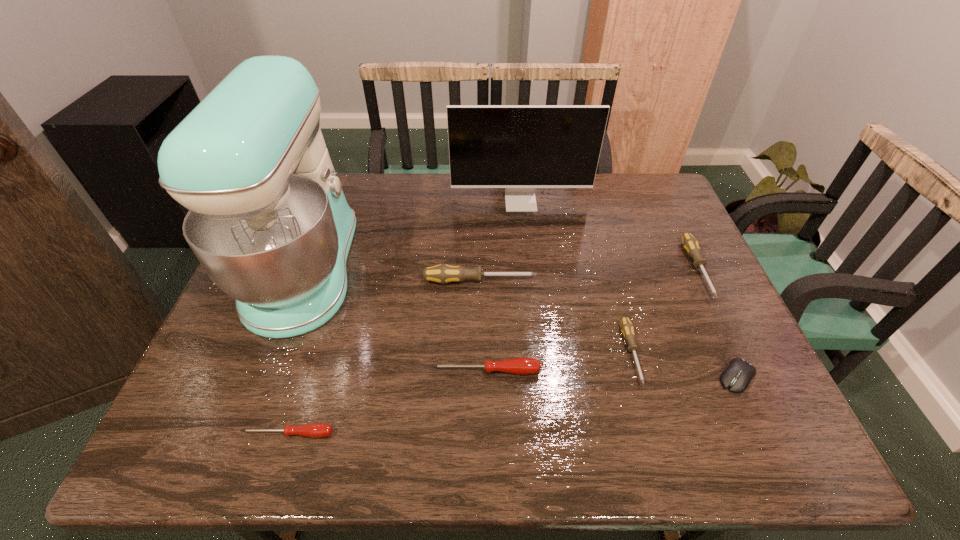
You are a GUI agent. You are given a task and a screenshot of the screen. Output one action in this format:
    pyautogui.click(x=<x>, y=<y>)
    Task: Click on the tallest object
    
    Given the screenshot: What is the action you would take?
    pyautogui.click(x=268, y=220)

Identify the location of mixer. (268, 220).

At what (x,y) coordinates should I click in order to perform the action: click on black monitor. Please return your answer as a coordinate pair (x, y). Looking at the image, I should click on (517, 147).

At what (x,y) coordinates should I click in order to perform the action: click on the farthest object. Please return your answer as a coordinate pair (x, y). This screenshot has width=960, height=540. Looking at the image, I should click on (517, 147).

The height and width of the screenshot is (540, 960). In order to click on the leftmost gray screwdriver in this screenshot , I will do `click(443, 273)`.

I want to click on the tallest screwdriver, so click(443, 273).

You are a GUI agent. You are given a task and a screenshot of the screen. Output one action in this format:
    pyautogui.click(x=<x>, y=<y>)
    Task: Click on the rightmost screwdriver
    Image resolution: width=960 pixels, height=540 pixels.
    Given the screenshot: What is the action you would take?
    pyautogui.click(x=690, y=244)

Where is `the second smallest gray screwdriver`? This screenshot has height=540, width=960. the second smallest gray screwdriver is located at coordinates (x=690, y=244).

Find the location of a particular element. the farther red screwdriver is located at coordinates (523, 366).

Image resolution: width=960 pixels, height=540 pixels. Identify the location of the right red screwdriver. (523, 366).